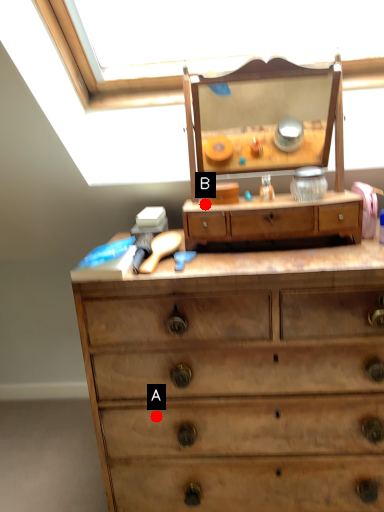
Question: Two points are circled on the image, labeled by A and B beside each circle. Which of the following is the farthest from the observer?

Choices:
 (A) A is further
 (B) B is further

Answer: (B)